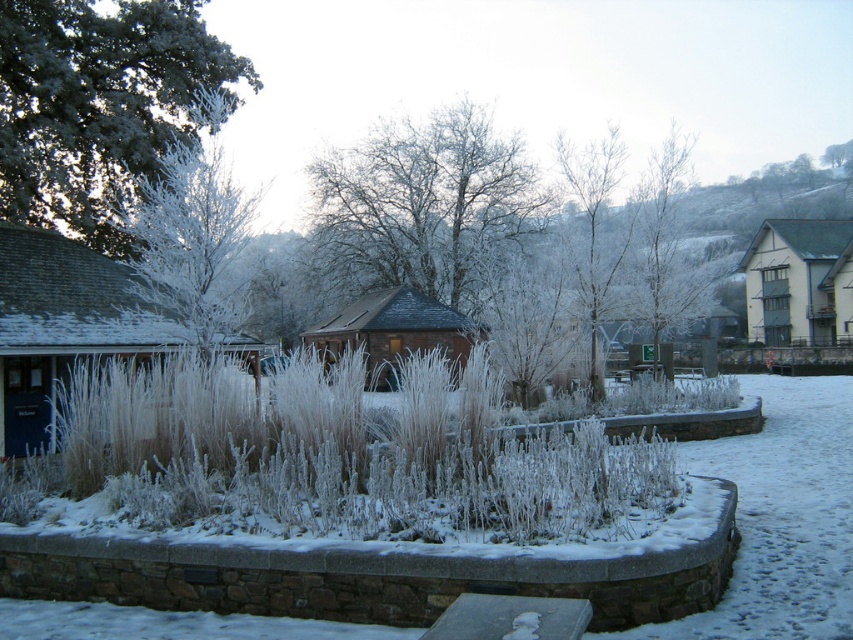
Is point (349, 240) behind point (669, 172)?

Yes, point (349, 240) is behind point (669, 172).

The height and width of the screenshot is (640, 853). What do you see at coordinates (422, 205) in the screenshot? I see `frosty bark tree at center` at bounding box center [422, 205].

Identify the location of frosty bark tree at center. Image resolution: width=853 pixels, height=640 pixels. (422, 205).

Who is positioned more to the left, frosted grass at center or frosty bark tree at upper left?

Positioned to the left is frosty bark tree at upper left.

Which is above, frosted grass at center or frosty bark tree at upper left?

frosty bark tree at upper left

Find the location of a particular element. frosted grass at center is located at coordinates (347, 456).

Does white frosty tree at left have a greater height compared to frosted wood tree at center?

Incorrect, white frosty tree at left's height is not larger of frosted wood tree at center's.

This screenshot has width=853, height=640. What do you see at coordinates (190, 225) in the screenshot?
I see `white frosty tree at left` at bounding box center [190, 225].

You are a GUI agent. You are given a task and a screenshot of the screen. Output one action in this format:
    pyautogui.click(x=<x>, y=<y>)
    Task: Click on the white frosty tree at left
    This screenshot has height=640, width=853.
    Given the screenshot: What is the action you would take?
    pyautogui.click(x=190, y=225)